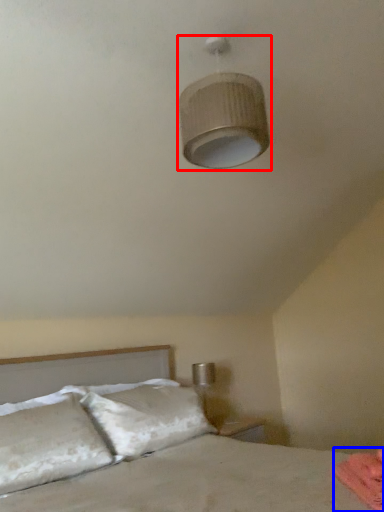
Question: Which point is further to the camera, lamp (highlighted by a red box) or sheet (highlighted by a blue box)?

Choices:
 (A) lamp
 (B) sheet

Answer: (A)